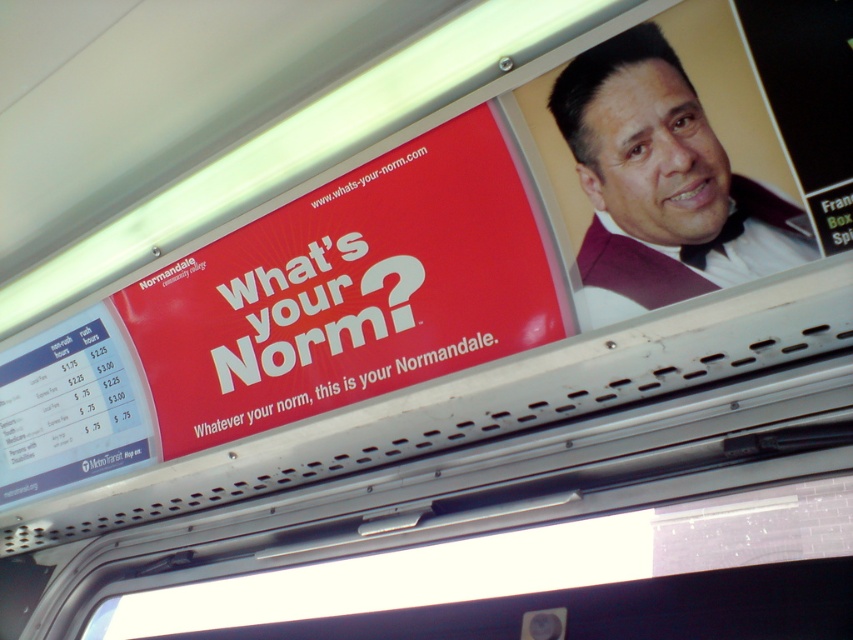
Question: Can you confirm if matte red sign at upper center is bigger than maroon textured vest at upper right?

Choices:
 (A) yes
 (B) no

Answer: (A)

Question: Can you confirm if matte red sign at upper center is positioned to the right of maroon textured vest at upper right?

Choices:
 (A) no
 (B) yes

Answer: (A)

Question: Does matte red sign at upper center appear over maroon textured vest at upper right?

Choices:
 (A) yes
 (B) no

Answer: (B)